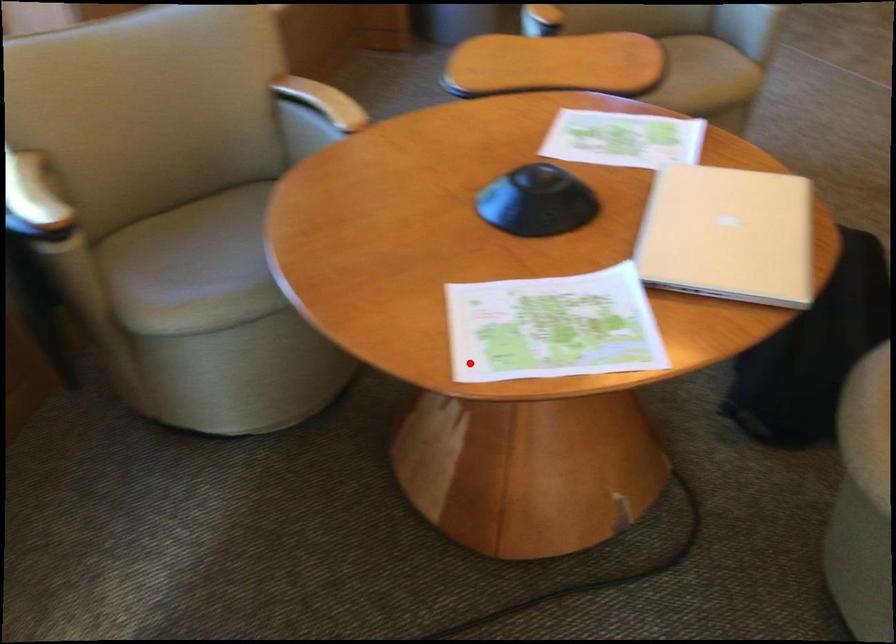
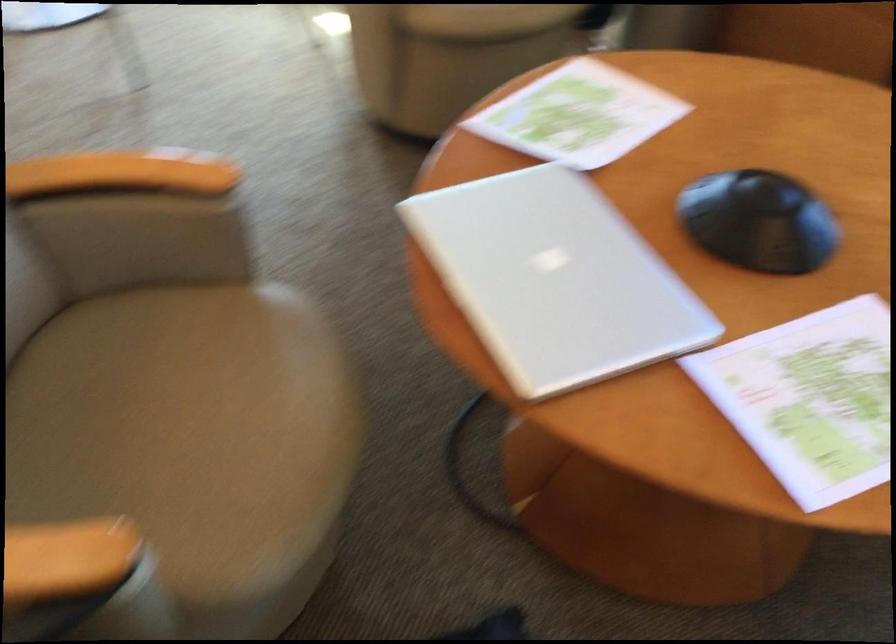
Question: I am providing you with two images of the same scene from different viewpoints. Given a red point in image1, look at the same physical point in image2. Is it:

Choices:
 (A) Closer to the viewpoint
 (B) Farther from the viewpoint

Answer: (B)